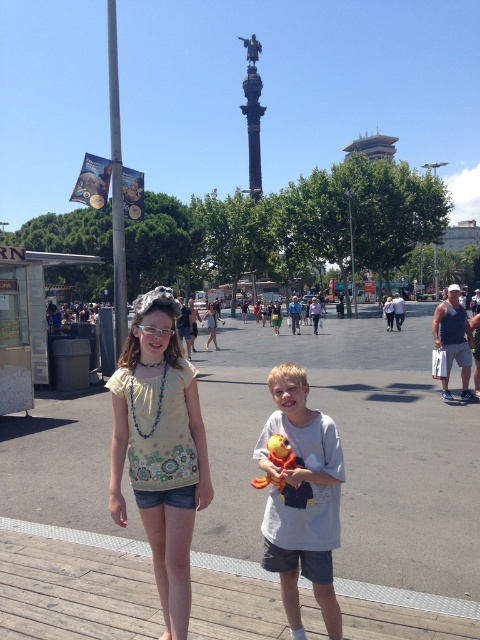
Is point (168, 381) in front of point (190, 337)?

Yes, it is in front of point (190, 337).

Measure the distance from light yellow cotton shirt at center to matte yellow blouse at center.

A distance of 20.39 meters exists between light yellow cotton shirt at center and matte yellow blouse at center.

Find the location of a particular element. The image size is (480, 640). light yellow cotton shirt at center is located at coordinates (159, 449).

Is point (170, 371) more distant than point (282, 461)?

That is True.

At what (x,y) coordinates should I click in order to perform the action: click on light yellow cotton shirt at center. Please return your answer as a coordinate pair (x, y). The width and height of the screenshot is (480, 640). Looking at the image, I should click on (159, 449).

Between point (326, 474) and point (207, 328), which one is positioned behind?

The point (207, 328) is behind.

Who is more distant from viewer, (300,452) or (205,310)?

Positioned behind is point (205,310).

Identify the location of light gray cotton shirt at center. Image resolution: width=480 pixels, height=640 pixels. click(300, 497).